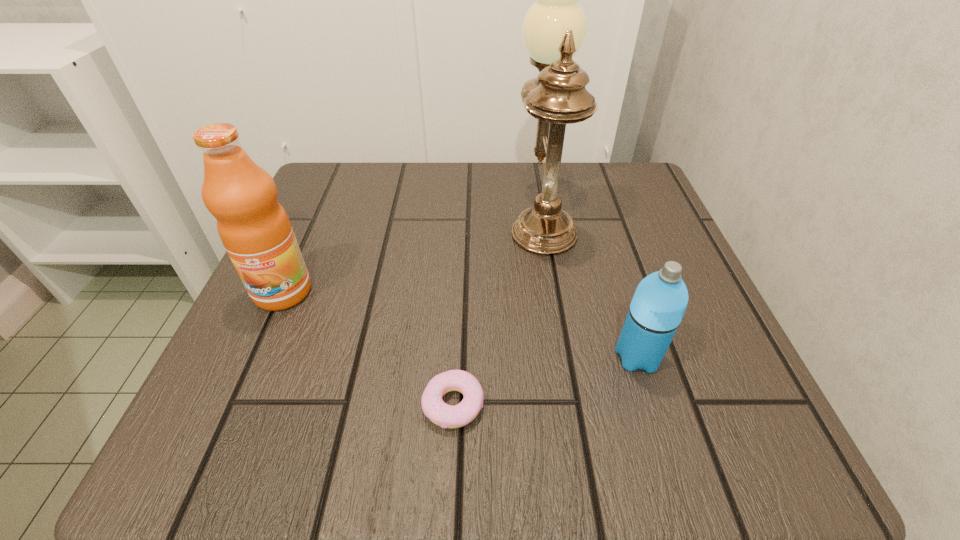
You are a GUI agent. You are given a task and a screenshot of the screen. Output one action in this format:
    pyautogui.click(x=<x>, y=<y>)
    Task: Click on the free space that satisfies the following two spatial constraints: 1. on the label side of the doughnut; 2. on the left side of the fruit juice
    
    Given the screenshot: What is the action you would take?
    pyautogui.click(x=232, y=404)